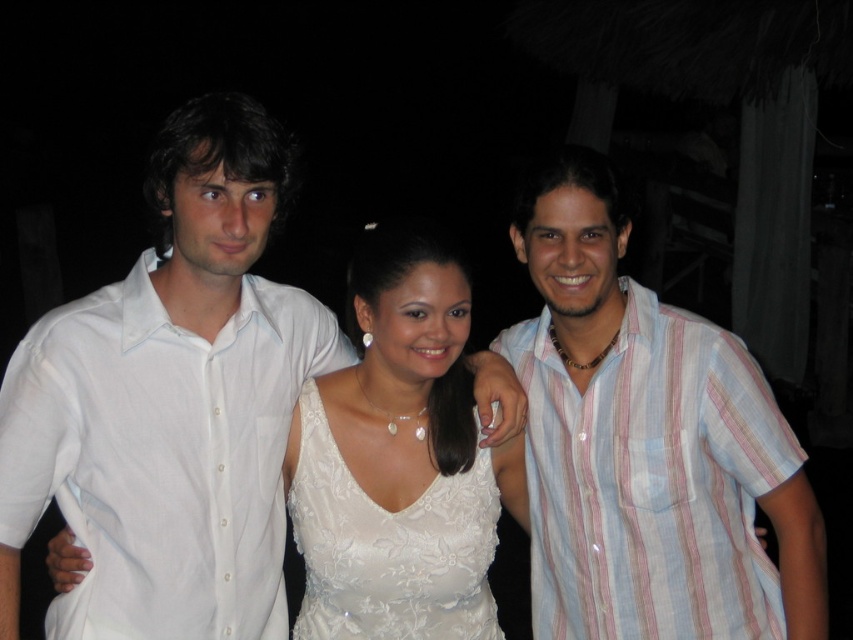
Can you confirm if white cotton shirt at left is smaller than white lace dress at center?

Incorrect, white cotton shirt at left is not smaller in size than white lace dress at center.

Is white cotton shirt at left further to camera compared to white lace dress at center?

No, white cotton shirt at left is closer to the viewer.

Who is more forward, [86,371] or [465,515]?

Positioned in front is point [86,371].

The height and width of the screenshot is (640, 853). What are the coordinates of `white cotton shirt at left` in the screenshot? It's located at (161, 456).

Does white cotton shirt at left have a larger size compared to light blue striped shirt at right?

Yes.

Is point (270, 285) closer to camera compared to point (650, 616)?

No, (270, 285) is behind (650, 616).

The height and width of the screenshot is (640, 853). Find the location of `white cotton shirt at left`. white cotton shirt at left is located at coordinates (161, 456).

Can you confirm if light blue striped shirt at right is taller than white lace dress at center?

Yes, light blue striped shirt at right is taller than white lace dress at center.

Who is lower down, light blue striped shirt at right or white lace dress at center?

white lace dress at center is below.

Is point (618, 632) closer to viewer compared to point (323, 624)?

That is False.

Locate an element on the screen. The height and width of the screenshot is (640, 853). light blue striped shirt at right is located at coordinates (650, 481).